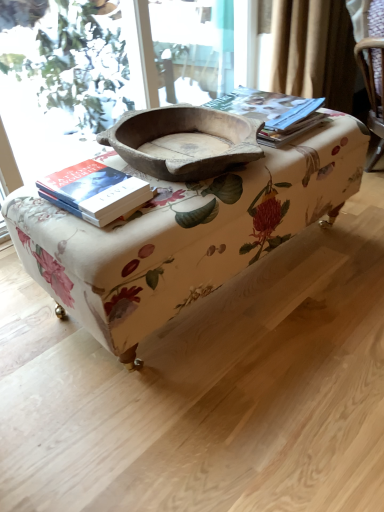
The width and height of the screenshot is (384, 512). I want to click on vacant area that lies to the right of hardcover book at left, so click(x=174, y=198).